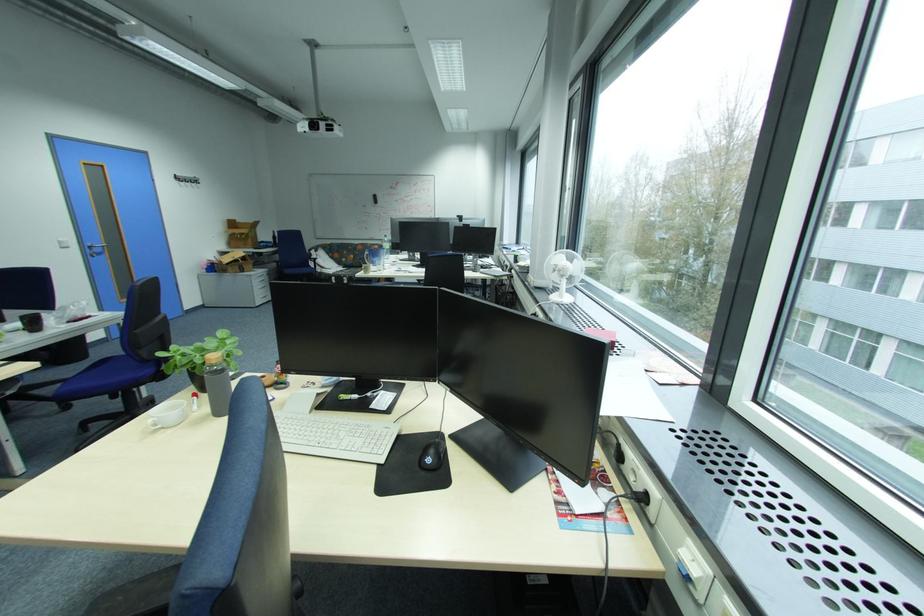
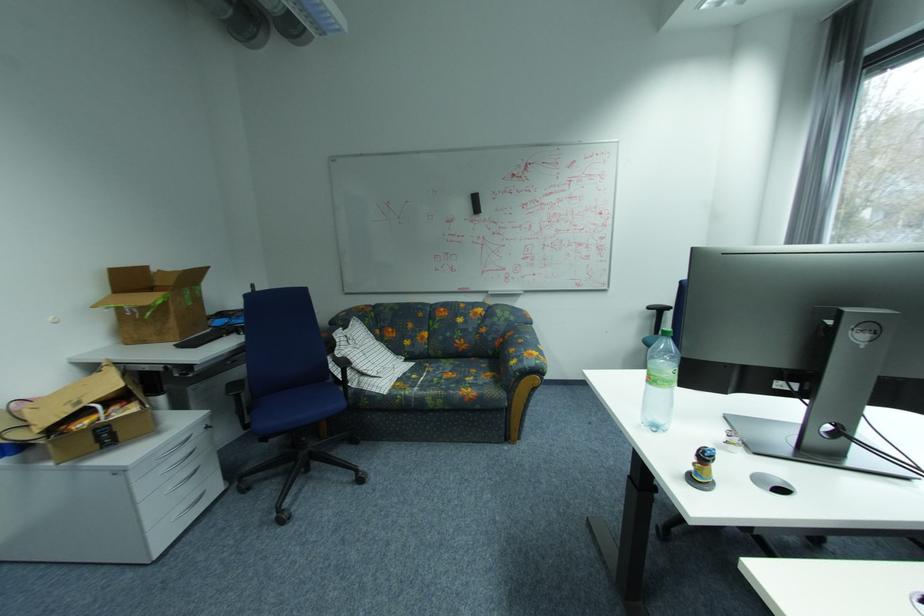
The point at (348,275) is marked in the first image. Where is the corresponding point in the second image?

(416, 392)